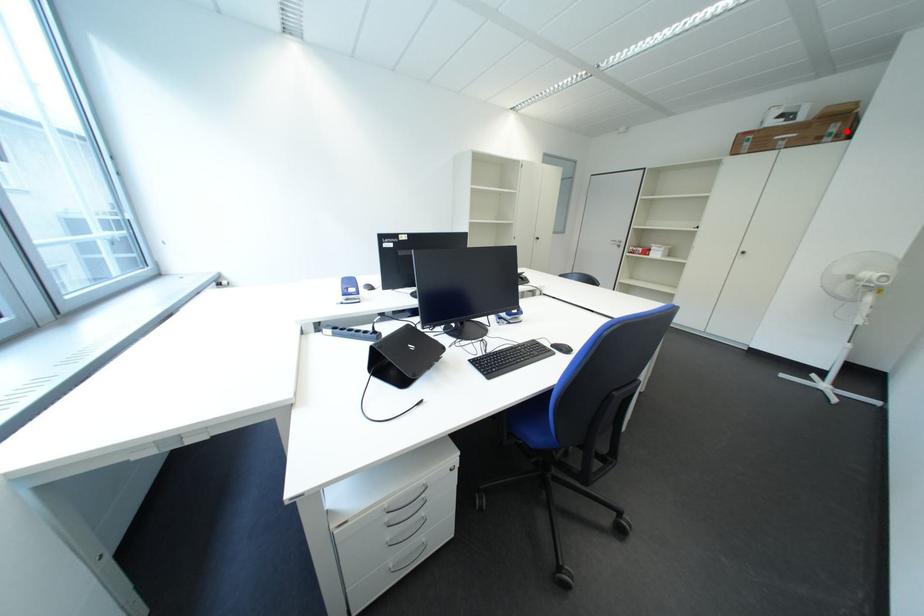
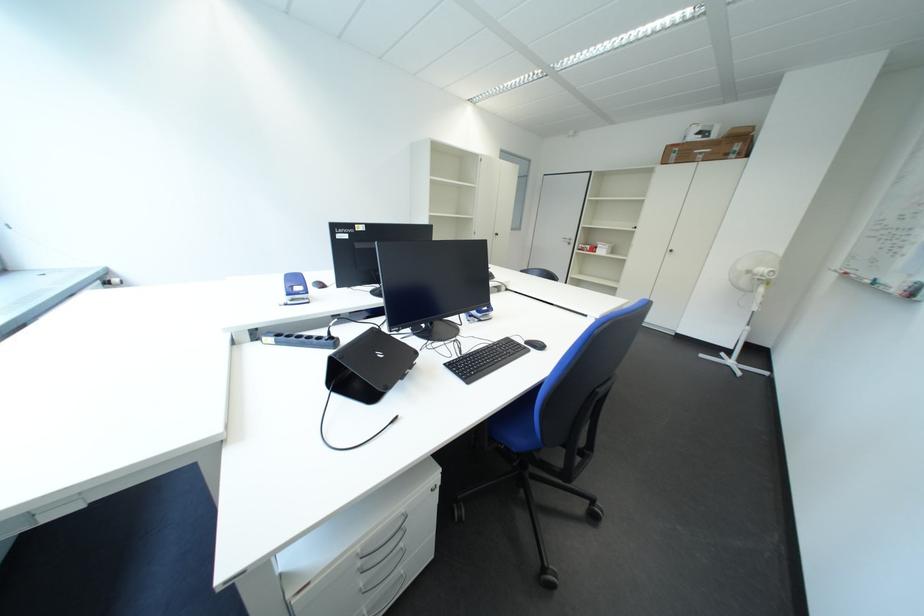
Find the pixel in the second image that matches the highlighted location in the first image.

(748, 150)